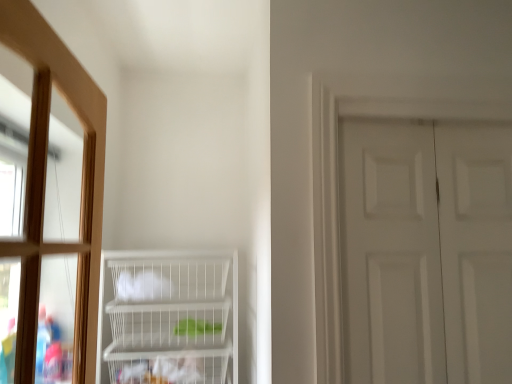
This screenshot has height=384, width=512. Describe the element at coordinates (426, 252) in the screenshot. I see `white matte door at right` at that location.

Where is `clear glass window at left`? clear glass window at left is located at coordinates (44, 185).

Locate an element on the screen. The width and height of the screenshot is (512, 384). white matte door at right is located at coordinates (426, 252).

Consider the image. Does white wire basket at lower center have a smaller size compared to white matte door at right?

Incorrect, white wire basket at lower center is not smaller in size than white matte door at right.

How many degrees apart are the facing directions of white wire basket at lower center and white matte door at right?

The facing directions of white wire basket at lower center and white matte door at right are 0.125 degrees apart.

Looking at this image, which object is closer to the camera taking this photo, white wire basket at lower center or white matte door at right?

white matte door at right is closer to the camera.

Between white wire basket at lower center and white matte door at right, which one has larger width?

white wire basket at lower center.

From a real-world perspective, is clear glass window at left on white matte door at right?

Yes, from a real-world perspective, clear glass window at left is on top of white matte door at right.

From the image's perspective, is clear glass window at left below white matte door at right?

No, from the image's perspective, clear glass window at left is not below white matte door at right.

In the scene shown: Which is more to the left, clear glass window at left or white matte door at right?

From the viewer's perspective, clear glass window at left appears more on the left side.

How many degrees apart are the facing directions of clear glass window at left and white matte door at right?

The angular difference between clear glass window at left and white matte door at right is 89 degrees.

Would you say white matte door at right is inside or outside white wire basket at lower center?

white matte door at right is located beyond the bounds of white wire basket at lower center.

Would you say white matte door at right is to the left or to the right of white wire basket at lower center in the picture?

Clearly, white matte door at right is on the right of white wire basket at lower center in the image.

Is white matte door at right turned away from white wire basket at lower center?

white matte door at right is not turned away from white wire basket at lower center.

Is white matte door at right touching white wire basket at lower center?

white matte door at right is not next to white wire basket at lower center, and they're not touching.

Does clear glass window at left come in front of white wire basket at lower center?

Yes, clear glass window at left is closer to the camera.

Looking at this image, is clear glass window at left facing towards white wire basket at lower center?

No, clear glass window at left is not aimed at white wire basket at lower center.

Considering the positions of point (20, 305) and point (115, 368), is point (20, 305) closer or farther from the camera than point (115, 368)?

Point (20, 305) is positioned closer to the camera compared to point (115, 368).

Is clear glass window at left not within white wire basket at lower center?

clear glass window at left lies outside white wire basket at lower center's area.

Which of these two, white wire basket at lower center or clear glass window at left, is wider?

Wider between the two is white wire basket at lower center.

In terms of height, does white wire basket at lower center look taller or shorter compared to clear glass window at left?

white wire basket at lower center is shorter than clear glass window at left.

In order to click on cupboard behind the clear glass window at left in this screenshot , I will do `click(169, 317)`.

From a real-world perspective, is white wire basket at lower center located higher than clear glass window at left?

No.

From a real-world perspective, is white matte door at right positioned above or below clear glass window at left?

In terms of real-world spatial position, white matte door at right is below clear glass window at left.

Is white matte door at right behind clear glass window at left?

Yes, it is.

Who is taller, white matte door at right or clear glass window at left?

With more height is white matte door at right.

Would you say white matte door at right is inside or outside clear glass window at left?

white matte door at right is not inside clear glass window at left, it's outside.

You are a GUI agent. You are given a task and a screenshot of the screen. Output one action in this format:
    pyautogui.click(x=<x>, y=<y>)
    Task: Click on the door above the white wire basket at lower center (from the image's perspective)
    The width and height of the screenshot is (512, 384).
    Given the screenshot: What is the action you would take?
    pyautogui.click(x=426, y=252)

Where is `door below the clear glass window at left (from a real-world perspective)`? Image resolution: width=512 pixels, height=384 pixels. door below the clear glass window at left (from a real-world perspective) is located at coordinates (426, 252).

From the image, which object appears to be farther from white wire basket at lower center, clear glass window at left or white matte door at right?

Based on the image, white matte door at right appears to be further to white wire basket at lower center.

Looking at the image, which one is located further to clear glass window at left, white wire basket at lower center or white matte door at right?

Based on the image, white matte door at right appears to be further to clear glass window at left.

From the image, which object appears to be farther from white wire basket at lower center, white matte door at right or clear glass window at left?

Among the two, white matte door at right is located further to white wire basket at lower center.

When comparing their distances from clear glass window at left, does white matte door at right or white wire basket at lower center seem closer?

white wire basket at lower center is positioned closer to the anchor clear glass window at left.

Estimate the real-world distances between objects in this image. Which object is further from white matte door at right, white wire basket at lower center or clear glass window at left?

The object further to white matte door at right is clear glass window at left.

When comparing their distances from white matte door at right, does clear glass window at left or white wire basket at lower center seem further?

clear glass window at left.

The height and width of the screenshot is (384, 512). In order to click on door positioned between clear glass window at left and white wire basket at lower center from near to far in this screenshot , I will do `click(426, 252)`.